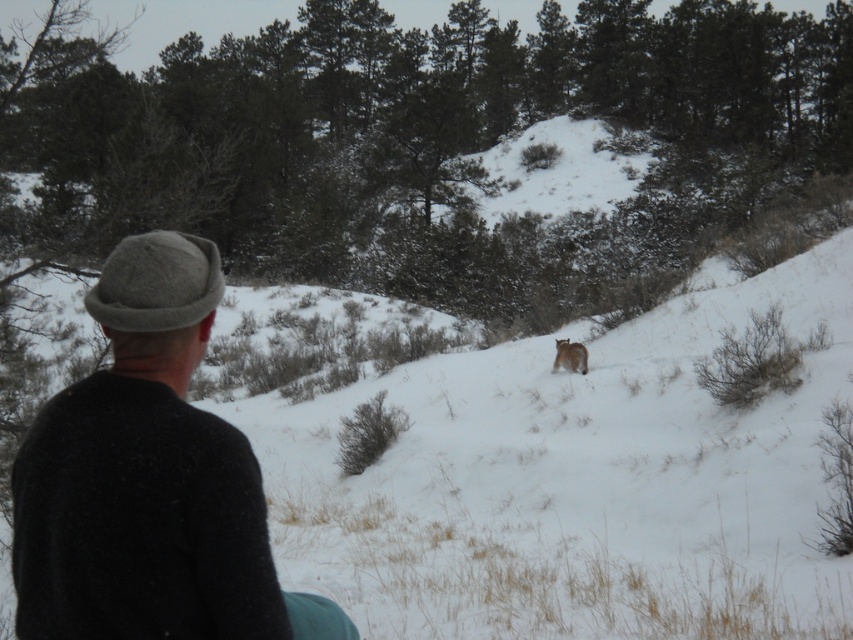
You are a photographer trying to capture a photo of the gray woolen hat at left and the furry brown cat at center in the same frame. Given that your camera has a maximum focus range of 40 feet, will you be able to include both objects in the photo without moving closer?

The distance between the gray woolen hat at left and the furry brown cat at center is 40.21 feet, which exceeds the camera maximum focus range of 40 feet. Therefore, you cannot include both objects in the same frame without moving closer.